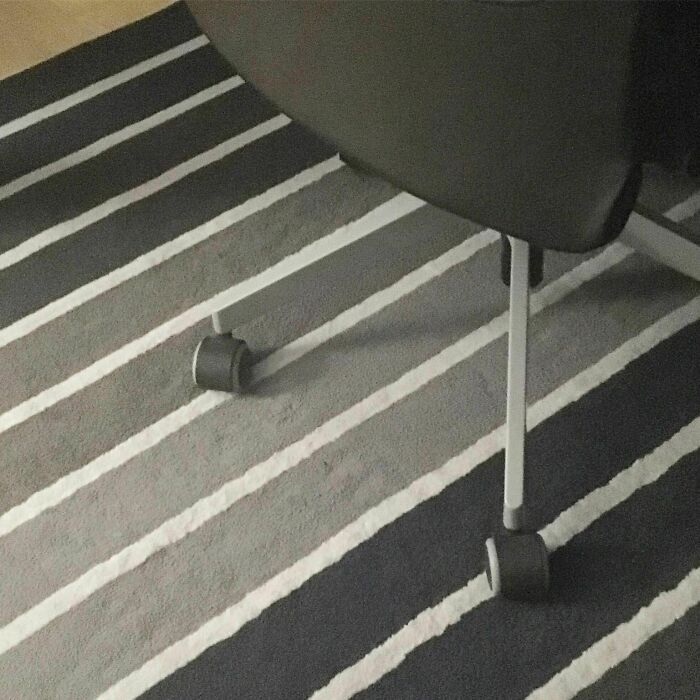
Locate an element on the screen. Image resolution: width=700 pixels, height=700 pixels. striped rug is located at coordinates (85, 406), (174, 486), (267, 558), (379, 647), (456, 680).